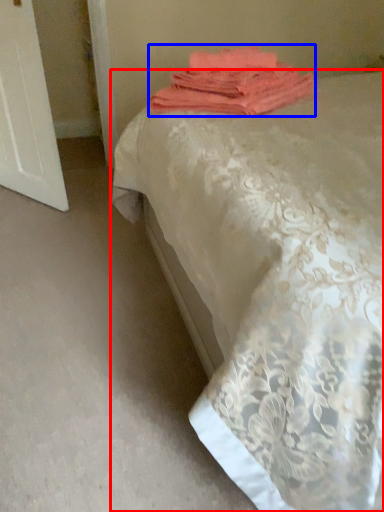
Question: Which point is closer to the camera, bed (highlighted by a red box) or towel (highlighted by a blue box)?

Choices:
 (A) bed
 (B) towel

Answer: (A)